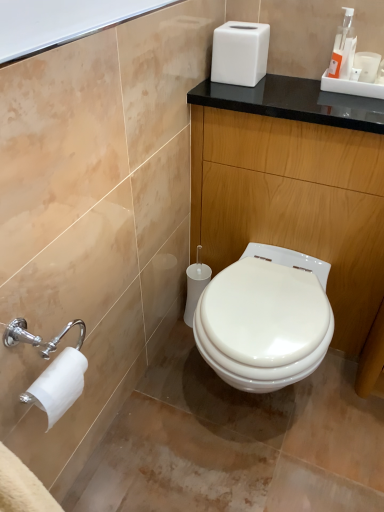
Measure the distance between point (229,185) and camera.

They are 1.41 meters apart.

This screenshot has height=512, width=384. What do you see at coordinates (294, 185) in the screenshot?
I see `black glossy counter at center` at bounding box center [294, 185].

Locate an element on the screen. The height and width of the screenshot is (512, 384). black glossy counter at center is located at coordinates (294, 185).

Can you tell me how much black glossy counter at center and white matte toilet paper at lower left differ in facing direction?

The angle between the facing direction of black glossy counter at center and the facing direction of white matte toilet paper at lower left is 88.7 degrees.

Where is `toilet paper below the black glossy counter at center (from the image's perspective)`? toilet paper below the black glossy counter at center (from the image's perspective) is located at coordinates (58, 385).

From a real-world perspective, is black glossy counter at center positioned above or below white matte toilet paper at lower left?

In terms of real-world spatial position, black glossy counter at center is below white matte toilet paper at lower left.

From their relative heights in the image, would you say black glossy counter at center is taller or shorter than white matte toilet paper at lower left?

In the image, black glossy counter at center appears to be taller than white matte toilet paper at lower left.

Does white matte tissue box at upper center turn towards black glossy counter at center?

No, white matte tissue box at upper center does not turn towards black glossy counter at center.

Which point is more forward, (224, 79) or (239, 236)?

The point (224, 79) is more forward.

Are white matte tissue box at upper center and black glossy counter at center making contact?

white matte tissue box at upper center and black glossy counter at center are not in contact.

From the picture: Looking at the image, does white matte toilet paper at lower left seem bigger or smaller compared to white matte tissue box at upper center?

Clearly, white matte toilet paper at lower left is smaller in size than white matte tissue box at upper center.

Considering the sizes of white matte toilet paper at lower left and white matte tissue box at upper center in the image, is white matte toilet paper at lower left taller or shorter than white matte tissue box at upper center?

Clearly, white matte toilet paper at lower left is shorter compared to white matte tissue box at upper center.

At what (x,y) coordinates should I click in order to perform the action: click on toilet paper below the white matte tissue box at upper center (from the image's perspective). Please return your answer as a coordinate pair (x, y). This screenshot has height=512, width=384. Looking at the image, I should click on (58, 385).

Between white matte tissue box at upper center and orange plastic soap dispenser at upper right, which one has larger size?

With larger size is white matte tissue box at upper center.

Between white matte tissue box at upper center and orange plastic soap dispenser at upper right, which one is positioned in front?

orange plastic soap dispenser at upper right is more forward.

Which point is more distant from viewer, [264,69] or [354,32]?

The point [264,69] is behind.

Could you measure the distance between white matte tissue box at upper center and orange plastic soap dispenser at upper right?

white matte tissue box at upper center is 10.68 inches from orange plastic soap dispenser at upper right.

Which of these two, orange plastic soap dispenser at upper right or white matte toilet paper at lower left, is thinner?

white matte toilet paper at lower left.

Can you confirm if orange plastic soap dispenser at upper right is shorter than white matte toilet paper at lower left?

Incorrect, the height of orange plastic soap dispenser at upper right does not fall short of that of white matte toilet paper at lower left.

Between point (352, 9) and point (54, 388), which one is positioned in front?

The point (54, 388) is in front.

From the image's perspective, between orange plastic soap dispenser at upper right and white matte toilet paper at lower left, who is located below?

white matte toilet paper at lower left, from the image's perspective.

Based on the photo, does orange plastic soap dispenser at upper right lie behind white matte tissue box at upper center?

No, orange plastic soap dispenser at upper right is closer to the viewer.

Is white matte tissue box at upper center at the back of orange plastic soap dispenser at upper right?

orange plastic soap dispenser at upper right is not turned away from white matte tissue box at upper center.

From a real-world perspective, which object stands above the other?

In real-world perspective, orange plastic soap dispenser at upper right is above.

Which of these two, orange plastic soap dispenser at upper right or white matte tissue box at upper center, is smaller?

With smaller size is orange plastic soap dispenser at upper right.

From a real-world perspective, between black glossy counter at center and white matte tissue box at upper center, who is vertically higher?

white matte tissue box at upper center, from a real-world perspective.

Is white matte tissue box at upper center a part of black glossy counter at center?

No, white matte tissue box at upper center is located outside of black glossy counter at center.

Is black glossy counter at center not near white matte tissue box at upper center?

No, black glossy counter at center is not far away from white matte tissue box at upper center.

From the image's perspective, is black glossy counter at center above white matte tissue box at upper center?

No, from the image's perspective, black glossy counter at center is not above white matte tissue box at upper center.

Identify the location of toilet paper in front of the black glossy counter at center. Image resolution: width=384 pixels, height=512 pixels. (58, 385).

Where is `appliance to the left of black glossy counter at center`? This screenshot has width=384, height=512. appliance to the left of black glossy counter at center is located at coordinates (240, 53).

Looking at the image, which one is located closer to orange plastic soap dispenser at upper right, white matte toilet paper at lower left or white matte tissue box at upper center?

white matte tissue box at upper center lies closer to orange plastic soap dispenser at upper right than the other object.

From the image, which object appears to be nearer to white matte tissue box at upper center, black glossy counter at center or white matte toilet paper at lower left?

black glossy counter at center is closer to white matte tissue box at upper center.

Which object lies nearer to the anchor point black glossy counter at center, white matte tissue box at upper center or orange plastic soap dispenser at upper right?

Based on the image, white matte tissue box at upper center appears to be nearer to black glossy counter at center.

From the image, which object appears to be nearer to black glossy counter at center, orange plastic soap dispenser at upper right or white matte toilet paper at lower left?

Among the two, orange plastic soap dispenser at upper right is located nearer to black glossy counter at center.

Estimate the real-world distances between objects in this image. Which object is further from white matte tissue box at upper center, black glossy counter at center or orange plastic soap dispenser at upper right?

Based on the image, black glossy counter at center appears to be further to white matte tissue box at upper center.

When comparing their distances from orange plastic soap dispenser at upper right, does black glossy counter at center or white matte toilet paper at lower left seem closer?

The object closer to orange plastic soap dispenser at upper right is black glossy counter at center.

When comparing their distances from black glossy counter at center, does orange plastic soap dispenser at upper right or white matte tissue box at upper center seem further?

Based on the image, orange plastic soap dispenser at upper right appears to be further to black glossy counter at center.

From the image, which object appears to be farther from orange plastic soap dispenser at upper right, white matte tissue box at upper center or white matte toilet paper at lower left?

white matte toilet paper at lower left lies further to orange plastic soap dispenser at upper right than the other object.

Image resolution: width=384 pixels, height=512 pixels. Find the location of `counter between orange plastic soap dispenser at upper right and white matte toilet paper at lower left vertically`. counter between orange plastic soap dispenser at upper right and white matte toilet paper at lower left vertically is located at coordinates (294, 185).

Identify the location of soap dispenser between white matte tissue box at upper center and white matte toilet paper at lower left from top to bottom. (343, 47).

This screenshot has width=384, height=512. What are the coordinates of `counter that lies between white matte tissue box at upper center and white matte toilet paper at lower left from top to bottom` in the screenshot? It's located at (294, 185).

Find the location of a particular element. soap dispenser between white matte tissue box at upper center and black glossy counter at center from top to bottom is located at coordinates (343, 47).